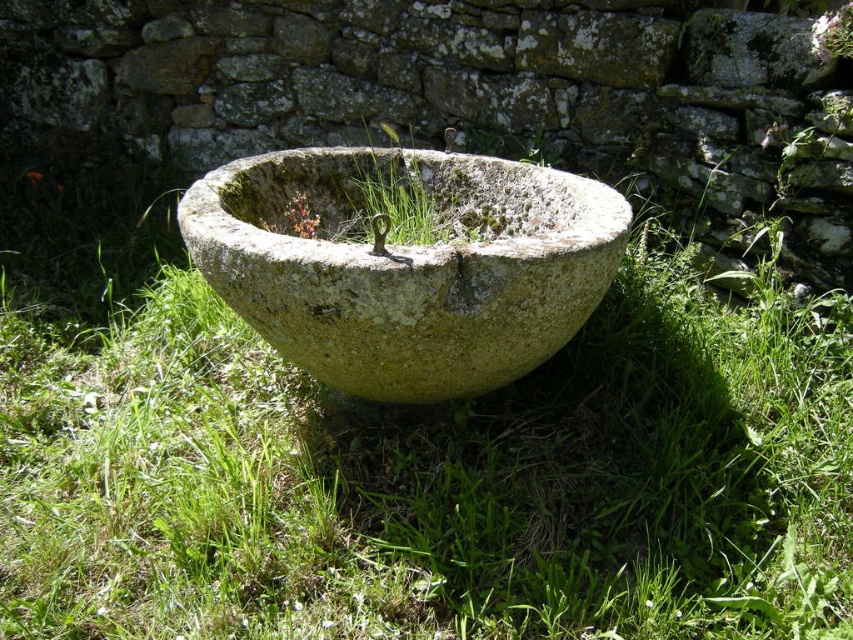
You are standing in a grassy area and see a point marked at coordinates (407,266). Based on the scene description, what object is located at that point?

The point at coordinates (407,266) corresponds to the green mossy stone bowl at center.

You are standing in front of the stone basin and want to place a small pebble on the point that is closer to you. Which point should you choose between point (334, 374) and point (448, 211)?

You should choose point (334, 374) because it is closer to the camera than point (448, 211).

You are a gardener who wants to place a small potted plant between the green mossy stone bowl at center and the green mossy stone at center. Which object should you place the plant closer to if you want it to have more space around it?

You should place the plant closer to the green mossy stone bowl at center because it has a larger size compared to the green mossy stone at center, providing more space around it.